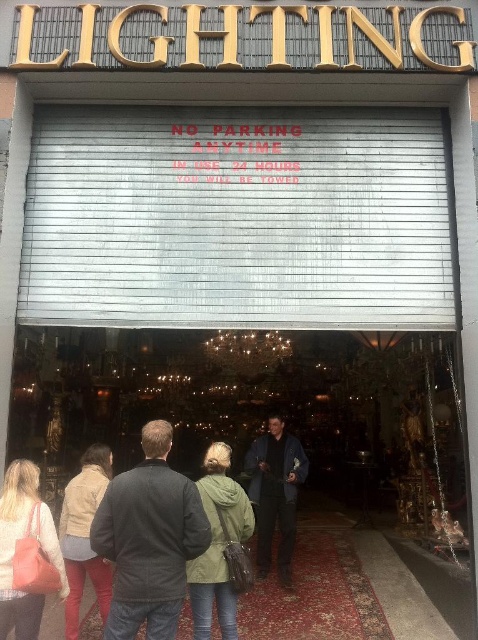
Question: Is green matte jacket at center in front of matte beige jacket at lower left?

Choices:
 (A) yes
 (B) no

Answer: (A)

Question: Which of the following is the closest to the observer?

Choices:
 (A) (218, 540)
 (B) (286, 435)
 (C) (111, 541)

Answer: (C)

Question: Is dark gray jacket at center positioned in front of matte pink purse at lower left?

Choices:
 (A) yes
 (B) no

Answer: (A)

Question: Which point is farther to the camera?

Choices:
 (A) dark gray jacket at center
 (B) navy blue jacket at center
 (C) matte beige jacket at lower left
 (D) green matte jacket at center

Answer: (B)

Question: Can you confirm if green matte jacket at center is positioned to the left of matte beige jacket at lower left?

Choices:
 (A) no
 (B) yes

Answer: (A)

Question: Among these objects, which one is farthest from the camera?

Choices:
 (A) navy blue jacket at center
 (B) matte beige jacket at lower left
 (C) green matte jacket at center

Answer: (A)